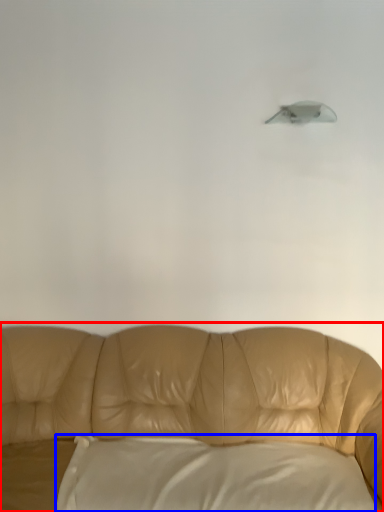
Question: Among these objects, which one is nearest to the camera, studio couch (highlighted by a red box) or pillow (highlighted by a blue box)?

Choices:
 (A) studio couch
 (B) pillow

Answer: (A)